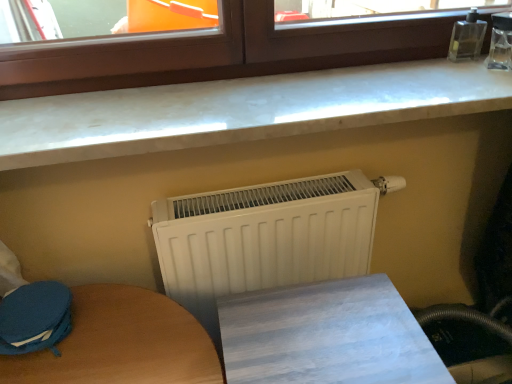
Question: Is white matte radiator at center taller or shorter than brown wood window at upper center?

Choices:
 (A) short
 (B) tall

Answer: (B)

Question: In the image, is white matte radiator at center positioned in front of or behind brown wood window at upper center?

Choices:
 (A) behind
 (B) front

Answer: (A)

Question: Considering the real-world distances, which object is closest to the white marble countertop at upper center?

Choices:
 (A) brown wood window at upper center
 (B) wooden table at lower center
 (C) white matte radiator at center
 (D) blue fabric swivel chair at lower left

Answer: (A)

Question: Considering the real-world distances, which object is closest to the wooden table at lower center?

Choices:
 (A) blue fabric swivel chair at lower left
 (B) white matte radiator at center
 (C) white marble countertop at upper center
 (D) brown wood window at upper center

Answer: (B)